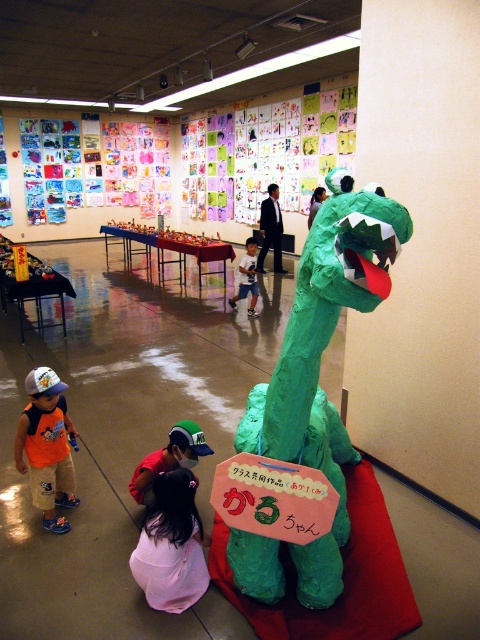
You are a photographer standing in the middle of the room. You want to take a photo that includes both the orange cotton shirt at lower left and the light blue fabric shirt at center. Given that your camera has a maximum focus range of 4 meters, will you be able to capture both shirts in the same frame without moving?

The distance between the orange cotton shirt at lower left and the light blue fabric shirt at center is 4.48 meters. Since the camera can only focus up to 4 meters, the shirts are too far apart to be captured in the same frame without moving closer or adjusting the focus.